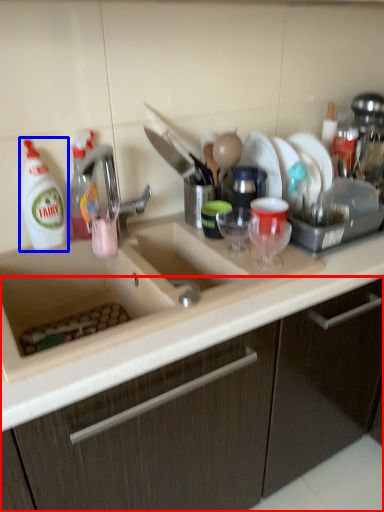
Question: Which object is closer to the camera taking this photo, cabinetry (highlighted by a red box) or cleaning product (highlighted by a blue box)?

Choices:
 (A) cabinetry
 (B) cleaning product

Answer: (A)